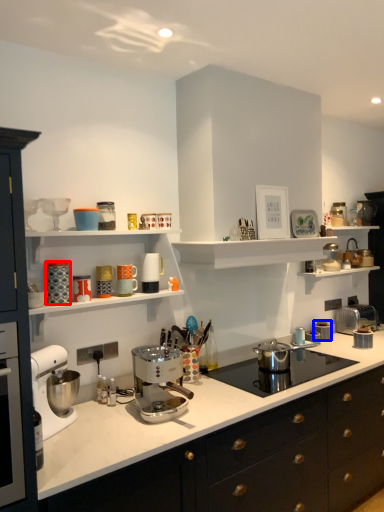
Question: Which of the following is the farthest to the observer, kitchen appliance (highlighted by a red box) or kitchen appliance (highlighted by a blue box)?

Choices:
 (A) kitchen appliance
 (B) kitchen appliance

Answer: (B)